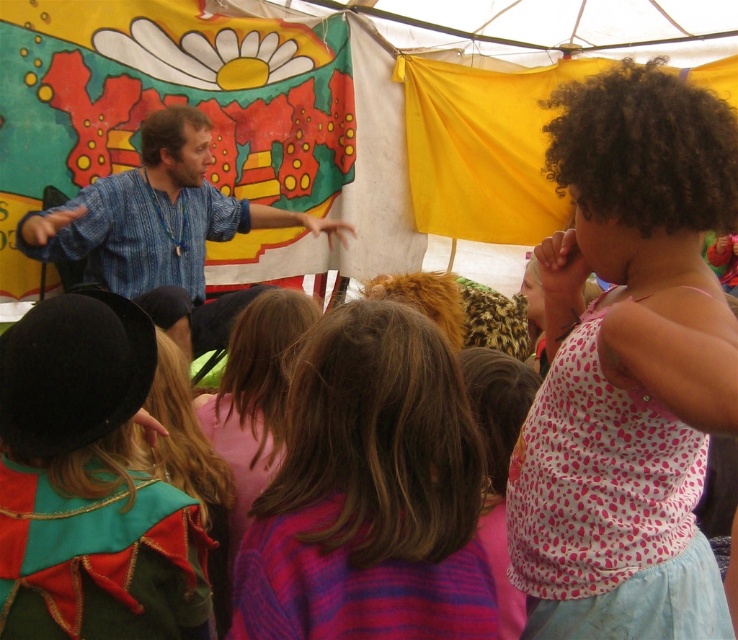
Is multicolored striped sweater at center behind velvet green cape at lower left?

No, multicolored striped sweater at center is in front of velvet green cape at lower left.

Is point (406, 554) in front of point (196, 616)?

Yes, it is in front of point (196, 616).

Locate an element on the screen. The width and height of the screenshot is (738, 640). multicolored striped sweater at center is located at coordinates (369, 493).

At what (x,y) coordinates should I click in order to perform the action: click on multicolored striped sweater at center. Please return your answer as a coordinate pair (x, y). This screenshot has height=640, width=738. Looking at the image, I should click on (369, 493).

In the scene shown: Is yellow fabric tent at upper center shorter than blonde hair at center?

No.

Who is positioned more to the left, yellow fabric tent at upper center or blonde hair at center?

Positioned to the left is yellow fabric tent at upper center.

Is point (292, 195) positioned in front of point (266, 465)?

No.

Where is `yellow fabric tent at upper center`? The height and width of the screenshot is (640, 738). yellow fabric tent at upper center is located at coordinates (213, 122).

Is point (624, 413) more distant than point (244, 426)?

No.

Does pink dotted tank top at upper right have a greater width compared to blonde hair at center?

Yes, pink dotted tank top at upper right is wider than blonde hair at center.

Locate an element on the screen. The height and width of the screenshot is (640, 738). pink dotted tank top at upper right is located at coordinates (620, 369).